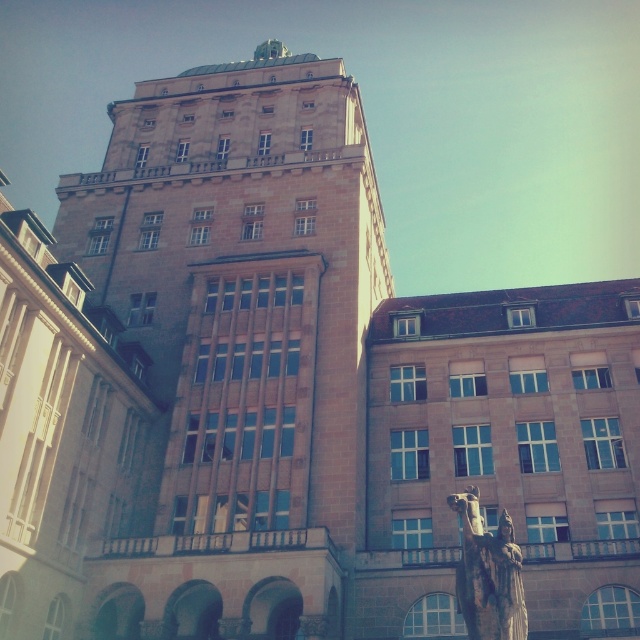
Question: Can you confirm if brown stone tower at center is thinner than bronze statue at center?

Choices:
 (A) no
 (B) yes

Answer: (A)

Question: Is brown stone tower at center closer to camera compared to bronze statue at center?

Choices:
 (A) yes
 (B) no

Answer: (B)

Question: Which point appears farthest from the camera in this image?

Choices:
 (A) (112, 227)
 (B) (474, 545)

Answer: (A)

Question: Does brown stone tower at center appear on the left side of bronze statue at center?

Choices:
 (A) yes
 (B) no

Answer: (A)